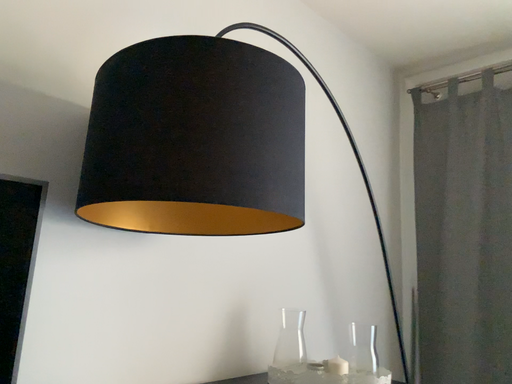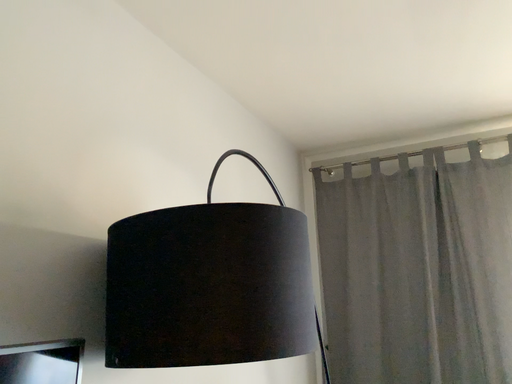
Question: Which way did the camera rotate in the video?

Choices:
 (A) rotated left
 (B) rotated right

Answer: (B)